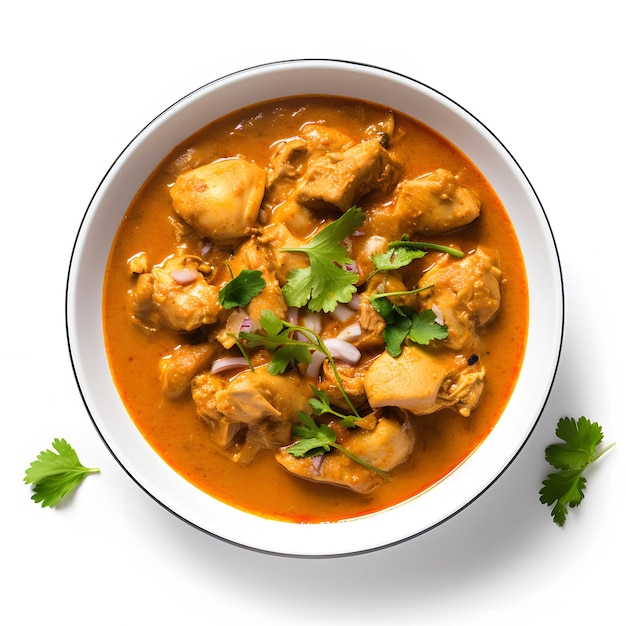
Locate an element on the screen. white bowl is located at coordinates (83, 270), (197, 503), (540, 357), (530, 240).